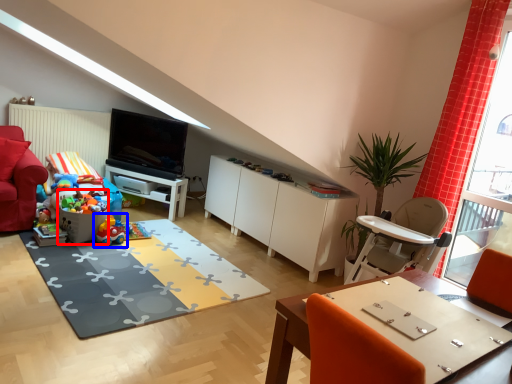
Question: Which point is further to the camera, toy (highlighted by a red box) or toy (highlighted by a blue box)?

Choices:
 (A) toy
 (B) toy

Answer: (B)